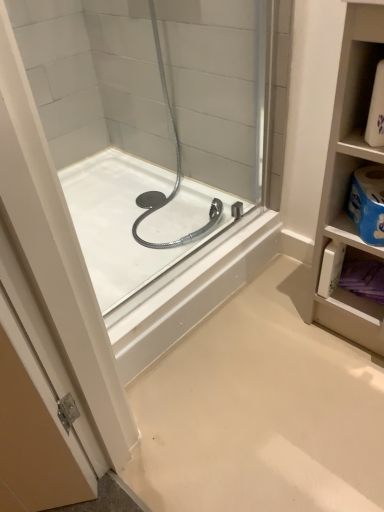
Question: Is white plastic shelf at upper right in front of white glossy bathtub at center?

Choices:
 (A) yes
 (B) no

Answer: (A)

Question: Is white plastic shelf at upper right shorter than white glossy bathtub at center?

Choices:
 (A) no
 (B) yes

Answer: (A)

Question: Is white plastic shelf at upper right at the left side of white glossy bathtub at center?

Choices:
 (A) yes
 (B) no

Answer: (B)

Question: Can you confirm if white plastic shelf at upper right is wider than white glossy bathtub at center?

Choices:
 (A) yes
 (B) no

Answer: (B)

Question: Is white plastic shelf at upper right located outside white glossy bathtub at center?

Choices:
 (A) yes
 (B) no

Answer: (A)

Question: Can you confirm if white plastic shelf at upper right is smaller than white glossy bathtub at center?

Choices:
 (A) yes
 (B) no

Answer: (A)

Question: From a real-world perspective, is white glossy bathtub at center on white plastic shelf at upper right?

Choices:
 (A) yes
 (B) no

Answer: (B)

Question: Is white glossy bathtub at center shorter than white plastic shelf at upper right?

Choices:
 (A) yes
 (B) no

Answer: (A)

Question: Could you tell me if white glossy bathtub at center is turned towards white plastic shelf at upper right?

Choices:
 (A) no
 (B) yes

Answer: (A)

Question: Is white glossy bathtub at center taller than white plastic shelf at upper right?

Choices:
 (A) no
 (B) yes

Answer: (A)

Question: Is white glossy bathtub at center smaller than white plastic shelf at upper right?

Choices:
 (A) yes
 (B) no

Answer: (B)

Question: Is white glossy bathtub at center oriented away from white plastic shelf at upper right?

Choices:
 (A) yes
 (B) no

Answer: (B)

Question: Is white plastic shelf at upper right taller or shorter than white glossy bathtub at center?

Choices:
 (A) short
 (B) tall

Answer: (B)